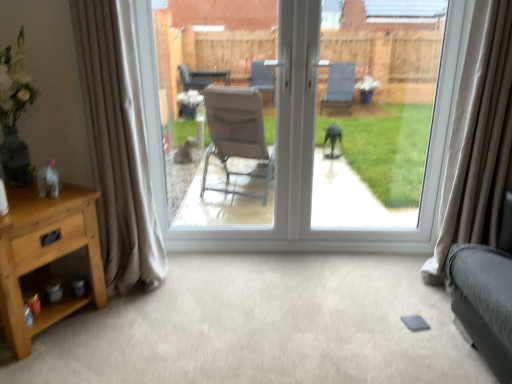
This screenshot has height=384, width=512. I want to click on transparent glass window at center, so click(x=385, y=124).

Describe the element at coordinates (385, 124) in the screenshot. The width and height of the screenshot is (512, 384). I see `transparent glass window at center` at that location.

What do you see at coordinates (45, 255) in the screenshot? I see `light brown wood nightstand at lower left` at bounding box center [45, 255].

Describe the element at coordinates (117, 144) in the screenshot. The width and height of the screenshot is (512, 384). I see `beige satin curtain at left, which appears as the first curtain when viewed from the left` at that location.

Locate an element on the screen. beige satin curtain at left, which appears as the first curtain when viewed from the left is located at coordinates tap(117, 144).

Locate an element on the screen. The width and height of the screenshot is (512, 384). transparent glass window at center is located at coordinates (385, 124).

Considering the positions of objects transparent glass window at center and beige velvet curtain at right, the second curtain in the left-to-right sequence, in the image provided, who is more to the left, transparent glass window at center or beige velvet curtain at right, the second curtain in the left-to-right sequence,?

transparent glass window at center is more to the left.

Based on the photo, could you measure the distance between transparent glass window at center and beige velvet curtain at right, which appears as the first curtain when viewed from the right?

2.73 meters.

From the image's perspective, which is below, transparent glass window at center or beige velvet curtain at right, the second curtain in the left-to-right sequence?

beige velvet curtain at right, the second curtain in the left-to-right sequence, from the image's perspective.

Considering the sizes of transparent glass window at center and beige velvet curtain at right, which appears as the first curtain when viewed from the right, in the image, is transparent glass window at center wider or thinner than beige velvet curtain at right, which appears as the first curtain when viewed from the right,?

transparent glass window at center is thinner than beige velvet curtain at right, which appears as the first curtain when viewed from the right.

Visually, is beige satin curtain at left, which appears as the 2th curtain when viewed from the right, positioned to the left or to the right of transparent glass door at center?

beige satin curtain at left, which appears as the 2th curtain when viewed from the right, is to the left of transparent glass door at center.

Which point is more forward, (150, 235) or (430, 245)?

The point (150, 235) is closer to the camera.

Does beige satin curtain at left, which appears as the 2th curtain when viewed from the right, have a lesser width compared to transparent glass door at center?

In fact, beige satin curtain at left, which appears as the 2th curtain when viewed from the right, might be wider than transparent glass door at center.

Can you confirm if beige satin curtain at left, which appears as the 2th curtain when viewed from the right, is smaller than transparent glass door at center?

Correct, beige satin curtain at left, which appears as the 2th curtain when viewed from the right, occupies less space than transparent glass door at center.

What are the coordinates of `the 2nd curtain above the light brown wood nightstand at lower left (from the image's perspective)` in the screenshot? It's located at (117, 144).

Is light brown wood nightstand at lower left completely or partially outside of beige satin curtain at left, which appears as the first curtain when viewed from the left?

Yes, light brown wood nightstand at lower left is located beyond the bounds of beige satin curtain at left, which appears as the first curtain when viewed from the left.

Which object is wider, light brown wood nightstand at lower left or beige satin curtain at left, which appears as the first curtain when viewed from the left?

light brown wood nightstand at lower left is wider.

Measure the distance between transparent glass door at center and light brown wood nightstand at lower left.

The distance of transparent glass door at center from light brown wood nightstand at lower left is 35.29 inches.

From the picture: Which of these two, transparent glass door at center or light brown wood nightstand at lower left, is thinner?

Thinner between the two is transparent glass door at center.

Who is shorter, transparent glass door at center or light brown wood nightstand at lower left?

light brown wood nightstand at lower left is shorter.

From the image's perspective, is transparent glass door at center on top of light brown wood nightstand at lower left?

Yes, from the image's perspective, transparent glass door at center is on top of light brown wood nightstand at lower left.

How distant is beige velvet curtain at right, the second curtain in the left-to-right sequence, from light brown wood nightstand at lower left?

6.01 feet.

Is beige velvet curtain at right, the second curtain in the left-to-right sequence, in front of light brown wood nightstand at lower left?

That is False.

Considering the sizes of objects beige velvet curtain at right, the second curtain in the left-to-right sequence, and light brown wood nightstand at lower left in the image provided, who is smaller, beige velvet curtain at right, the second curtain in the left-to-right sequence, or light brown wood nightstand at lower left?

With smaller size is light brown wood nightstand at lower left.

Is beige velvet curtain at right, which appears as the first curtain when viewed from the right, looking in the opposite direction of light brown wood nightstand at lower left?

No, light brown wood nightstand at lower left is not at the back of beige velvet curtain at right, which appears as the first curtain when viewed from the right.

Which of these two, beige velvet curtain at right, which appears as the first curtain when viewed from the right, or transparent glass door at center, stands taller?

transparent glass door at center.

Based on the photo, is beige velvet curtain at right, which appears as the first curtain when viewed from the right, situated inside transparent glass door at center or outside?

beige velvet curtain at right, which appears as the first curtain when viewed from the right, exists outside the volume of transparent glass door at center.

Between point (451, 236) and point (159, 183), which one is positioned behind?

The point (159, 183) is farther from the camera.

Could you tell me if light brown wood nightstand at lower left is facing transparent glass window at center?

No, light brown wood nightstand at lower left is not facing towards transparent glass window at center.

Where is `window screen above the light brown wood nightstand at lower left (from the image's perspective)`? The image size is (512, 384). window screen above the light brown wood nightstand at lower left (from the image's perspective) is located at coordinates click(385, 124).

From a real-world perspective, is light brown wood nightstand at lower left over transparent glass window at center?

Incorrect, from a real-world perspective, light brown wood nightstand at lower left is lower than transparent glass window at center.

Is light brown wood nightstand at lower left thinner than transparent glass window at center?

In fact, light brown wood nightstand at lower left might be wider than transparent glass window at center.

This screenshot has width=512, height=384. Identify the location of window screen above the beige velvet curtain at right, the second curtain in the left-to-right sequence (from a real-world perspective). (385, 124).

The image size is (512, 384). There is a transparent glass door at center. Find the location of `the 1st curtain below it (from the image's perspective)`. the 1st curtain below it (from the image's perspective) is located at coordinates (117, 144).

When comparing their distances from transparent glass window at center, does beige satin curtain at left, which appears as the first curtain when viewed from the left, or transparent glass door at center seem closer?

transparent glass door at center lies closer to transparent glass window at center than the other object.

Looking at this image, based on their spatial positions, is beige satin curtain at left, which appears as the first curtain when viewed from the left, or light brown wood nightstand at lower left closer to transparent glass window at center?

light brown wood nightstand at lower left lies closer to transparent glass window at center than the other object.

Which object lies nearer to the anchor point transparent glass door at center, beige satin curtain at left, which appears as the 2th curtain when viewed from the right, or light brown wood nightstand at lower left?

beige satin curtain at left, which appears as the 2th curtain when viewed from the right, lies closer to transparent glass door at center than the other object.

Estimate the real-world distances between objects in this image. Which object is closer to beige satin curtain at left, which appears as the 2th curtain when viewed from the right, transparent glass door at center or light brown wood nightstand at lower left?

light brown wood nightstand at lower left is closer to beige satin curtain at left, which appears as the 2th curtain when viewed from the right.

Which object lies further to the anchor point transparent glass window at center, beige velvet curtain at right, which appears as the first curtain when viewed from the right, or beige satin curtain at left, which appears as the first curtain when viewed from the left?

Among the two, beige satin curtain at left, which appears as the first curtain when viewed from the left, is located further to transparent glass window at center.

Consider the image. Estimate the real-world distances between objects in this image. Which object is further from beige velvet curtain at right, the second curtain in the left-to-right sequence, beige satin curtain at left, which appears as the 2th curtain when viewed from the right, or transparent glass window at center?

transparent glass window at center.

Which object lies further to the anchor point beige velvet curtain at right, the second curtain in the left-to-right sequence, light brown wood nightstand at lower left or transparent glass door at center?

light brown wood nightstand at lower left is positioned further to the anchor beige velvet curtain at right, the second curtain in the left-to-right sequence.

Which object lies nearer to the anchor point transparent glass door at center, beige satin curtain at left, which appears as the first curtain when viewed from the left, or transparent glass window at center?

Among the two, beige satin curtain at left, which appears as the first curtain when viewed from the left, is located nearer to transparent glass door at center.

This screenshot has width=512, height=384. I want to click on window screen between light brown wood nightstand at lower left and beige velvet curtain at right, the second curtain in the left-to-right sequence, from left to right, so click(385, 124).

At what (x,y) coordinates should I click in order to perform the action: click on window located between beige satin curtain at left, which appears as the first curtain when viewed from the left, and beige velvet curtain at right, which appears as the first curtain when viewed from the right, in the left-right direction. Please return your answer as a coordinate pair (x, y). This screenshot has height=384, width=512. Looking at the image, I should click on (308, 166).

Where is `window screen between beige satin curtain at left, which appears as the first curtain when viewed from the left, and beige velvet curtain at right, the second curtain in the left-to-right sequence, in the horizontal direction`? window screen between beige satin curtain at left, which appears as the first curtain when viewed from the left, and beige velvet curtain at right, the second curtain in the left-to-right sequence, in the horizontal direction is located at coordinates (385, 124).

Locate an element on the screen. window located between light brown wood nightstand at lower left and beige velvet curtain at right, which appears as the first curtain when viewed from the right, in the left-right direction is located at coordinates (308, 166).